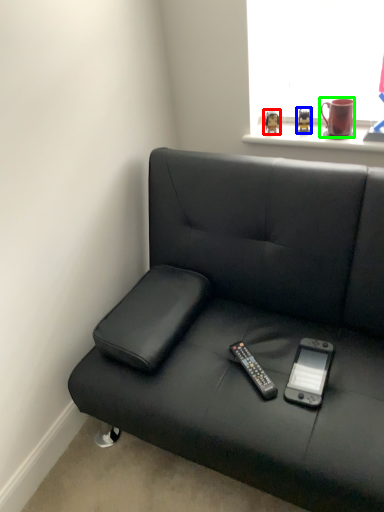
Question: Which is farther away from toy (highlighted by a red box)? toy (highlighted by a blue box) or mug (highlighted by a green box)?

Choices:
 (A) toy
 (B) mug

Answer: (B)